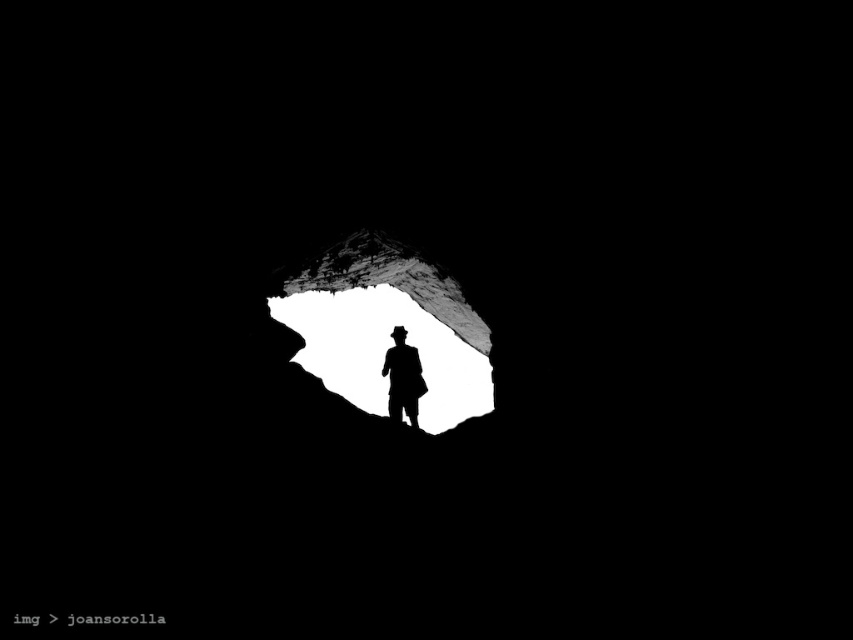
Looking at this image, you are a hiker who has reached the cave entrance. You need to enter the cave but must first determine if the entrance is wide enough for your backpack. The backpack measures 40 cm in width. Can you confirm if the entrance at point (x=386, y=326) is wide enough?

The entrance at point (x=386, y=326) is the white matte cave at center. Since the cave entrance is described as large and irregularly shaped, it is likely wider than 40 cm, so the backpack should fit through.

You are an explorer trying to determine the best path to enter the cave. Given the sizes of the white matte cave at center and the black matte silhouette at center, can you fit through the cave entrance without needing to squeeze?

The white matte cave at center is larger in size than the black matte silhouette at center, so yes, you can fit through the cave entrance without needing to squeeze since the cave is bigger than the silhouette representing the explorer.

You are an explorer standing in front of a cave entrance. You notice two points marked on the cave wall. The first point is at coordinates point (480, 353) and the second is at point (407, 364). Which point is closer to you?

Point (480, 353) is further to the viewer than point (407, 364), so the second point at (407, 364) is closer to you.